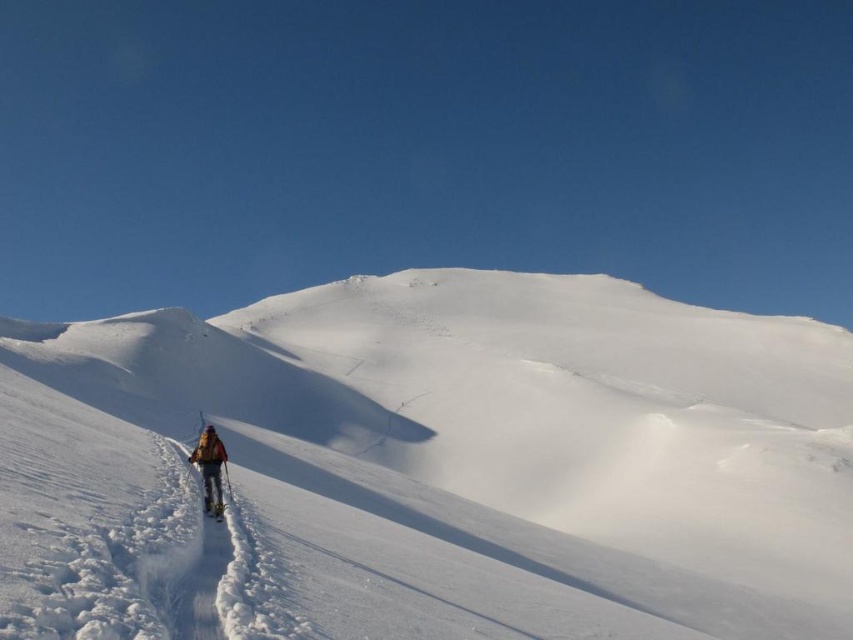
Based on the photo, you are a hiker planning to move from point A to point B in the winter landscape. Point A is at coordinate point (218, 436) and point B is at coordinate point (215, 509). Based on the terrain, which point is closer to you as you start your journey?

Point A at coordinate point (218, 436) is closer to you than point B at coordinate point (215, 509) because it is further to the viewer, meaning it is nearer in the scene.

You are planning to set up a tent for shelter during your winter trek. Given the coordinates provided for the white powdery snow at center, where should you place the tent to ensure it is on stable snow?

The white powdery snow at center is located at point (509, 449), so placing the tent at this coordinate ensures it is on stable snow.

You are a hiker planning to cross the area shown in the image. You see the white powdery snow at center and the white matte ski at lower center. Which object is deeper into the snow?

The white powdery snow at center is taller than the white matte ski at lower center, so the white matte ski at lower center is deeper into the snow.